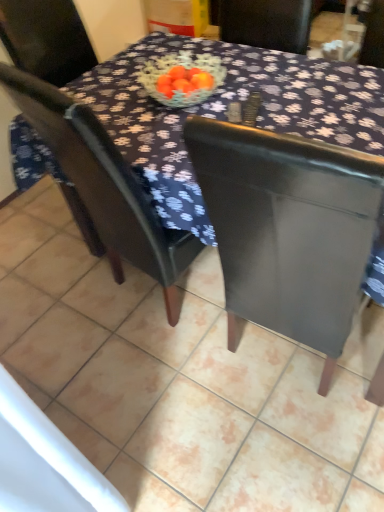
Question: Does dark fabric table at center come in front of matte black chair at center?

Choices:
 (A) no
 (B) yes

Answer: (B)

Question: Is dark fabric table at center turned away from matte black chair at center?

Choices:
 (A) yes
 (B) no

Answer: (A)

Question: From a real-world perspective, is dark fabric table at center beneath matte black chair at center?

Choices:
 (A) no
 (B) yes

Answer: (B)

Question: Does dark fabric table at center come behind matte black chair at center?

Choices:
 (A) yes
 (B) no

Answer: (B)

Question: From a real-world perspective, does dark fabric table at center stand above matte black chair at center?

Choices:
 (A) no
 (B) yes

Answer: (A)

Question: Choose the correct answer: Is dark fabric table at center inside matte black chair at center or outside it?

Choices:
 (A) inside
 (B) outside

Answer: (B)

Question: In terms of height, does dark fabric table at center look taller or shorter compared to matte black chair at center?

Choices:
 (A) short
 (B) tall

Answer: (A)

Question: From the image's perspective, is dark fabric table at center located above or below matte black chair at center?

Choices:
 (A) below
 (B) above

Answer: (A)

Question: Considering the positions of dark fabric table at center and matte black chair at center in the image, is dark fabric table at center bigger or smaller than matte black chair at center?

Choices:
 (A) big
 (B) small

Answer: (A)

Question: Visually, is matte black table at center positioned to the left or to the right of matte black chair at center?

Choices:
 (A) right
 (B) left

Answer: (A)

Question: From a real-world perspective, is matte black table at center physically located above or below matte black chair at center?

Choices:
 (A) below
 (B) above

Answer: (A)

Question: From the image's perspective, is matte black table at center above or below matte black chair at center?

Choices:
 (A) below
 (B) above

Answer: (A)

Question: Considering their positions, is matte black table at center located in front of or behind matte black chair at center?

Choices:
 (A) behind
 (B) front

Answer: (B)

Question: Would you say matte black chair at center is to the left or to the right of matte black table at center in the picture?

Choices:
 (A) left
 (B) right

Answer: (A)

Question: Is point (155, 227) closer or farther from the camera than point (13, 375)?

Choices:
 (A) farther
 (B) closer

Answer: (B)